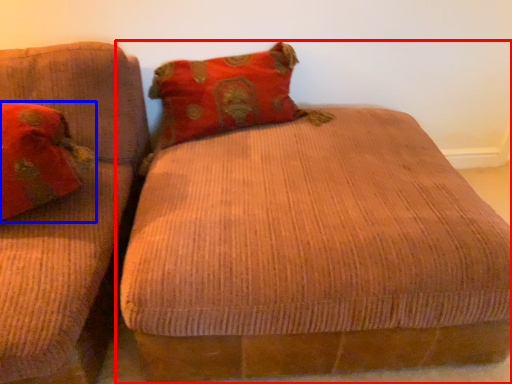
Question: Which point is further to the camera, studio couch (highlighted by a red box) or pillow (highlighted by a blue box)?

Choices:
 (A) studio couch
 (B) pillow

Answer: (B)